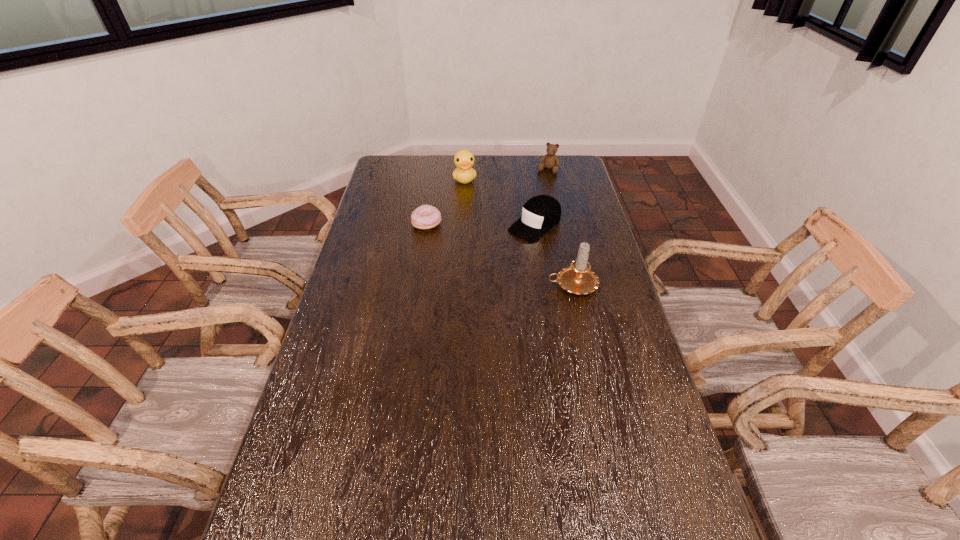
You are a GUI agent. You are given a task and a screenshot of the screen. Output one action in this format:
    pyautogui.click(x=<x>, y=<y>)
    Task: Click on the free space that satisfies the following two spatial constraints: 1. on the front side of the tallest object; 2. on the left side of the duck
    This screenshot has width=960, height=540.
    Given the screenshot: What is the action you would take?
    pyautogui.click(x=460, y=285)

Find the location of a particular element. Image resolution: width=960 pixels, height=540 pixels. free space that satisfies the following two spatial constraints: 1. on the back side of the doughnut; 2. on the right side of the duck is located at coordinates (433, 179).

Locate an element on the screen. This screenshot has height=540, width=960. vacant point that satisfies the following two spatial constraints: 1. on the back side of the third tallest object; 2. on the right side of the doughnut is located at coordinates (x=435, y=170).

Where is `free region that satisfies the following two spatial constraints: 1. on the back side of the second object from left to right; 2. on the left side of the teddy bear`? This screenshot has width=960, height=540. free region that satisfies the following two spatial constraints: 1. on the back side of the second object from left to right; 2. on the left side of the teddy bear is located at coordinates (465, 170).